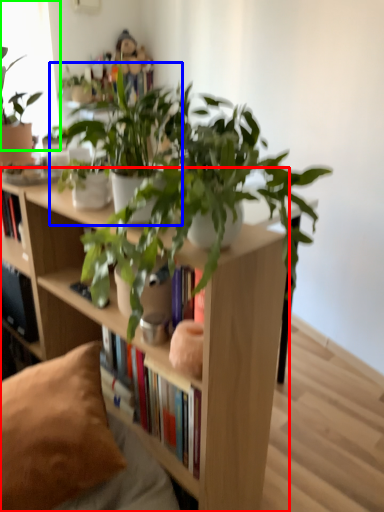
Question: Considering the real-world distances, which object is farthest from bookcase (highlighted by a red box)? houseplant (highlighted by a blue box) or window screen (highlighted by a green box)?

Choices:
 (A) houseplant
 (B) window screen

Answer: (B)